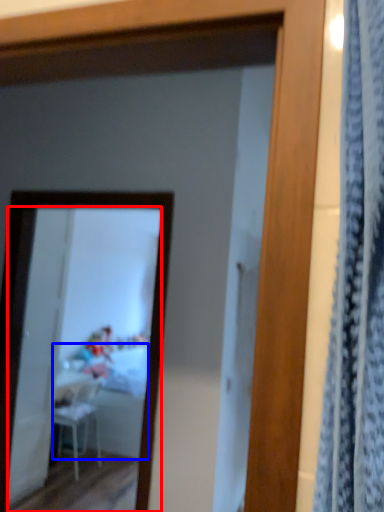
Question: Which of the following is the closest to the observer, mirror (highlighted by a red box) or table (highlighted by a blue box)?

Choices:
 (A) mirror
 (B) table

Answer: (A)